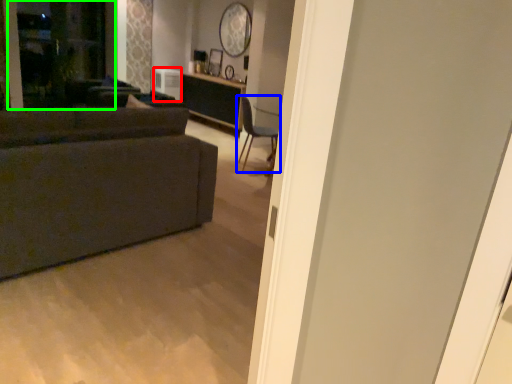
Question: Considering the real-world distances, which object is closest to appliance (highlighted by a red box)? chair (highlighted by a blue box) or screen door (highlighted by a green box).

Choices:
 (A) chair
 (B) screen door

Answer: (B)